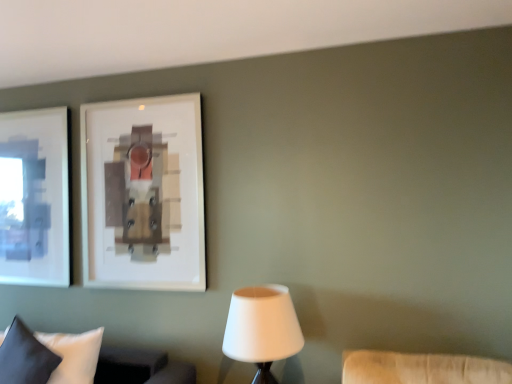
Question: Looking at the image, does dark blue fabric pillow at lower left seem bigger or smaller compared to white matte lampshade at lower center?

Choices:
 (A) big
 (B) small

Answer: (B)

Question: Which is correct: dark blue fabric pillow at lower left is inside white matte lampshade at lower center, or outside of it?

Choices:
 (A) inside
 (B) outside

Answer: (B)

Question: Considering the real-world distances, which object is closest to the white fabric pillow at lower left?

Choices:
 (A) white matte lampshade at lower center
 (B) dark blue fabric pillow at lower left

Answer: (B)

Question: Which is farther from the white matte lampshade at lower center?

Choices:
 (A) white fabric pillow at lower left
 (B) dark blue fabric pillow at lower left

Answer: (B)